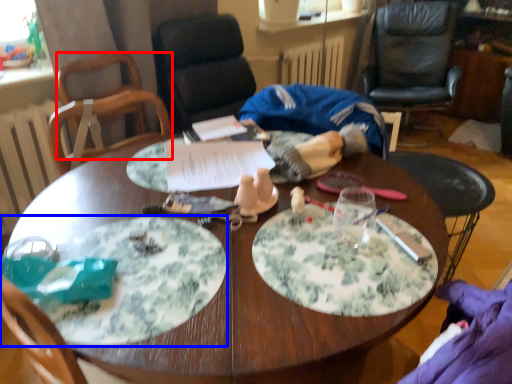
Question: Which of the following is the closest to the observer, chair (highlighted by a red box) or plate (highlighted by a blue box)?

Choices:
 (A) chair
 (B) plate

Answer: (B)